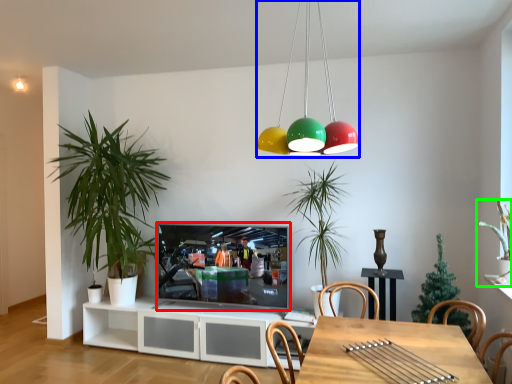
Question: Based on their relative distances, which object is nearer to television (highlighted by a red box)? Choose from chandelier (highlighted by a blue box) and houseplant (highlighted by a green box).

Choices:
 (A) chandelier
 (B) houseplant

Answer: (A)